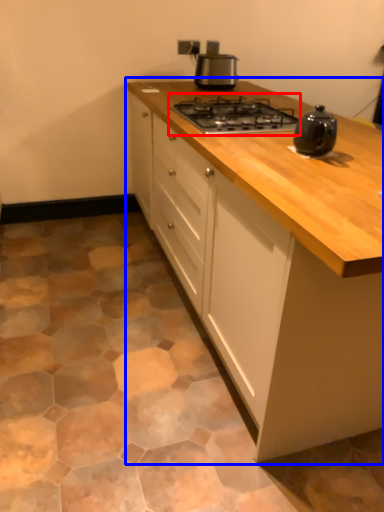
Question: Which object appears closest to the camera in this image, gas stove (highlighted by a red box) or cabinetry (highlighted by a blue box)?

Choices:
 (A) gas stove
 (B) cabinetry

Answer: (B)